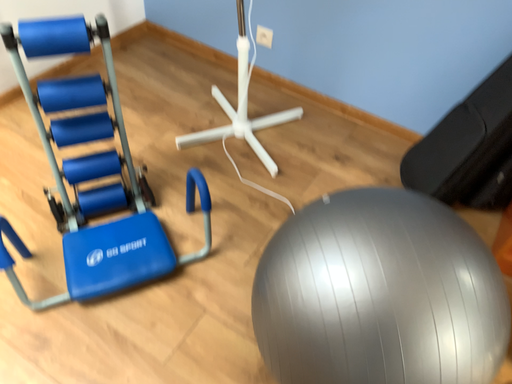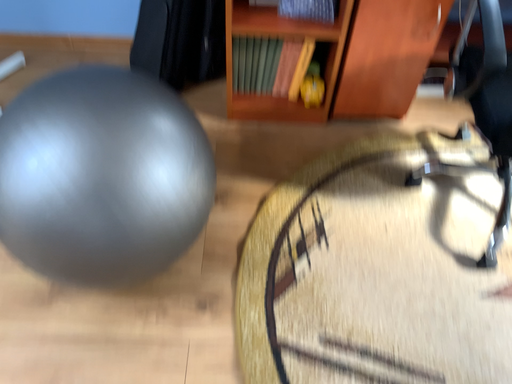
Question: How did the camera likely rotate when shooting the video?

Choices:
 (A) rotated right
 (B) rotated left

Answer: (A)